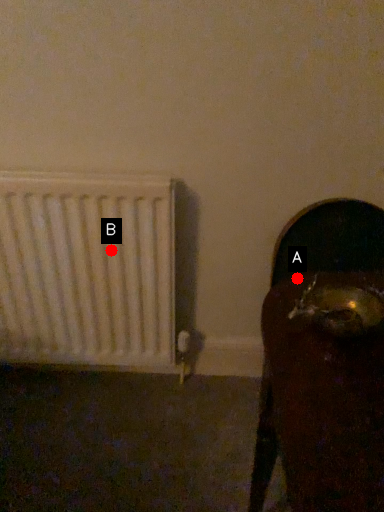
Question: Two points are circled on the image, labeled by A and B beside each circle. Which of the following is the closest to the observer?

Choices:
 (A) A is closer
 (B) B is closer

Answer: (A)